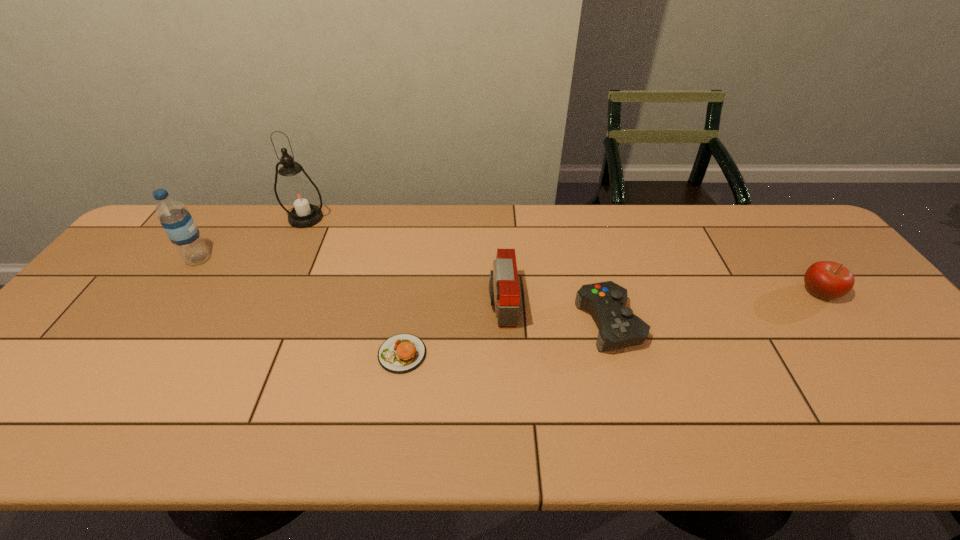
The image size is (960, 540). Identify the location of object that stands as the fourth closest to the fifth shortest object. (618, 327).

Identify the location of object that is the fourth closest to the patty. The height and width of the screenshot is (540, 960). (177, 222).

This screenshot has width=960, height=540. What are the coordinates of `vacant point that satisfies the following two spatial constraints: 1. on the label of the leftmost object; 2. on the right side of the control` in the screenshot? It's located at (x=155, y=323).

The width and height of the screenshot is (960, 540). What are the coordinates of `vacant space that satisfies the following two spatial constraints: 1. on the front side of the fourth tallest object; 2. on the front-facing side of the fourth object from left to right` in the screenshot? It's located at (828, 303).

The image size is (960, 540). I want to click on free spot that satisfies the following two spatial constraints: 1. on the back side of the third object from left to right; 2. on the label of the water bottle, so click(x=417, y=259).

The image size is (960, 540). What are the coordinates of `free spot that satisfies the following two spatial constraints: 1. on the label of the fifth shortest object; 2. on the right side of the control` in the screenshot? It's located at (155, 323).

Where is `vacant space that satisfies the following two spatial constraints: 1. on the label of the patty; 2. on the right side of the fifth nearest object`? Image resolution: width=960 pixels, height=540 pixels. vacant space that satisfies the following two spatial constraints: 1. on the label of the patty; 2. on the right side of the fifth nearest object is located at coordinates (133, 354).